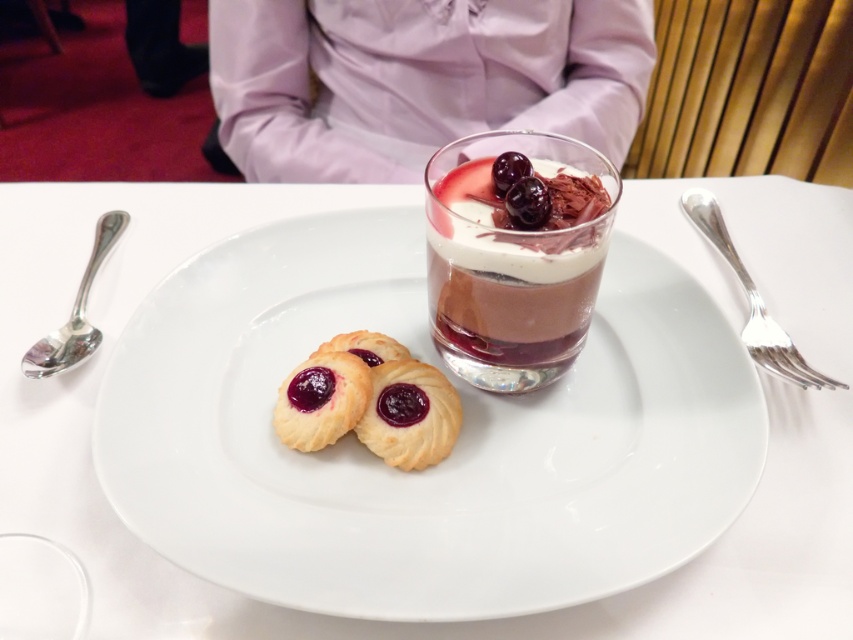
Question: Which point is closer to the camera?

Choices:
 (A) (729, 252)
 (B) (195, 420)

Answer: (B)

Question: Does white porcelain plate at center have a lesser width compared to golden crumbly cookie with jam filling at center?

Choices:
 (A) no
 (B) yes

Answer: (A)

Question: Which point is farther to the camera?

Choices:
 (A) silver metallic spoon at left
 (B) chocolate mousse at center
 (C) shiny dark purple cherry at center
 (D) white porcelain plate at center

Answer: (A)

Question: Which point is closer to the camera?

Choices:
 (A) glazed pastry at center
 (B) golden crumbly cookie with dark jam filling at center-left
 (C) golden crumbly cookie with jam filling at center

Answer: (B)

Question: Does golden crumbly cookie with dark jam filling at center-left have a greater width compared to shiny dark purple cherry at center?

Choices:
 (A) no
 (B) yes

Answer: (B)

Question: Does chocolate mousse at center lie behind slightly glossy dark purple jam at center?

Choices:
 (A) no
 (B) yes

Answer: (A)